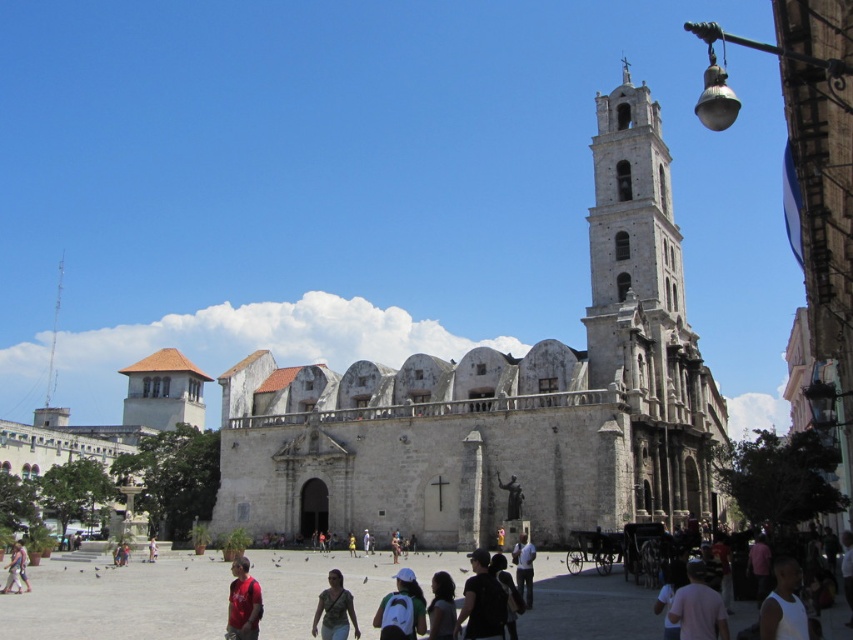
You are a tourist standing in the plaza in front of the historic stone church. You notice the white stone tower at center and the matte gray shirt at center. Which object is higher in the scene?

The white stone tower at center is higher than the matte gray shirt at center.

You are standing in the plaza in front of the historic stone church. You see two points marked in the image. Which point is closer to you, point (637, 129) or point (531, 600)?

Point (637, 129) is closer to you because it is further to the viewer than point (531, 600).

You are a tourist standing in the plaza in front of the historic stone church. You notice the white stone tower at center and the matte gray shirt at center. Which object is wider?

The white stone tower at center is wider than the matte gray shirt at center.